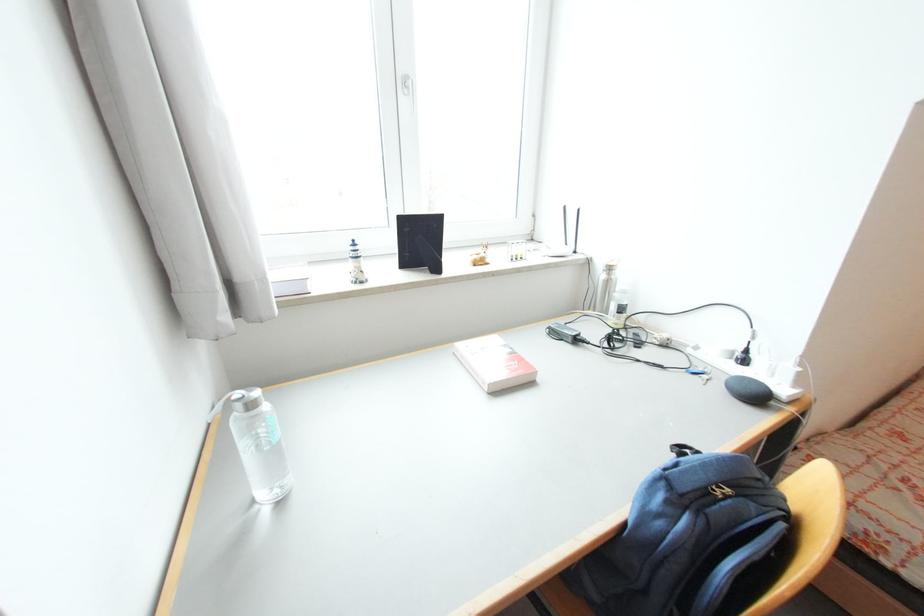
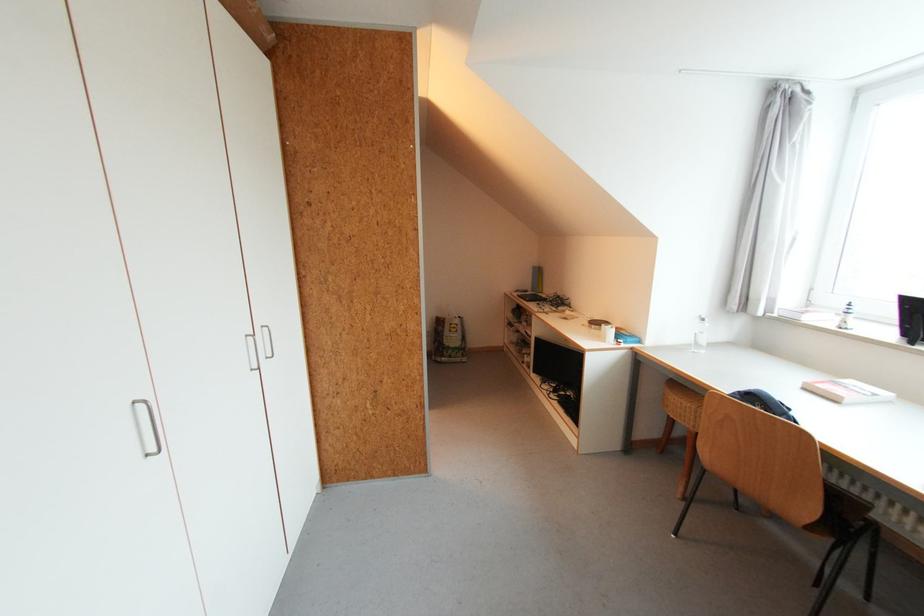
In the second image, find the point that corresponds to the point at 367,283 in the first image.

(845, 329)